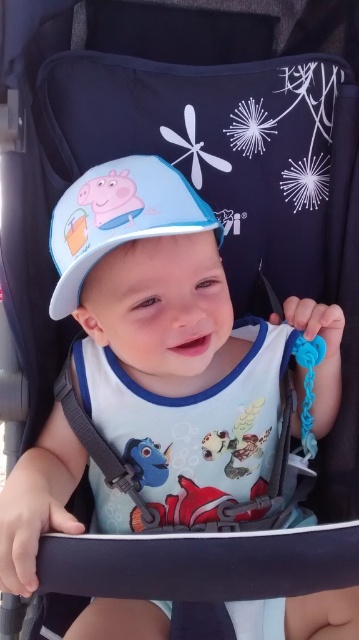
Who is taller, white matte bib at center or matte blue fabric hat at center?

Standing taller between the two is white matte bib at center.

Is white matte bib at center thinner than matte blue fabric hat at center?

Incorrect, white matte bib at center's width is not less than matte blue fabric hat at center's.

Who is more distant from viewer, (245, 436) or (82, 268)?

Positioned behind is point (245, 436).

Locate an element on the screen. white matte bib at center is located at coordinates (193, 426).